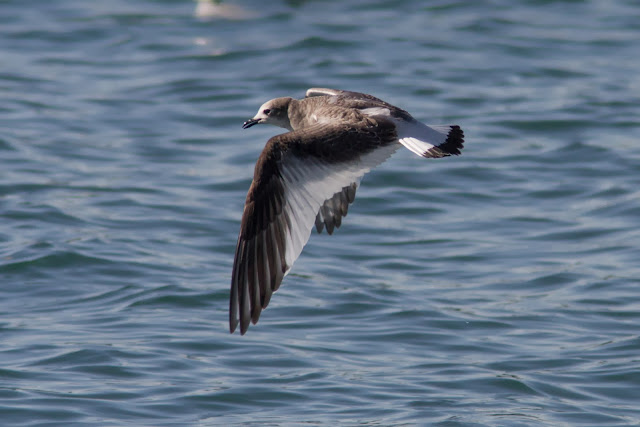
I want to click on tile, so click(246, 311).